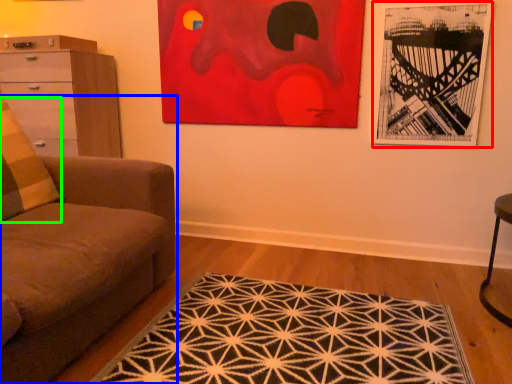
Question: Which object is positioned farthest from picture frame (highlighted by a red box)? Select from studio couch (highlighted by a blue box) and pillow (highlighted by a green box).

Choices:
 (A) studio couch
 (B) pillow

Answer: (B)